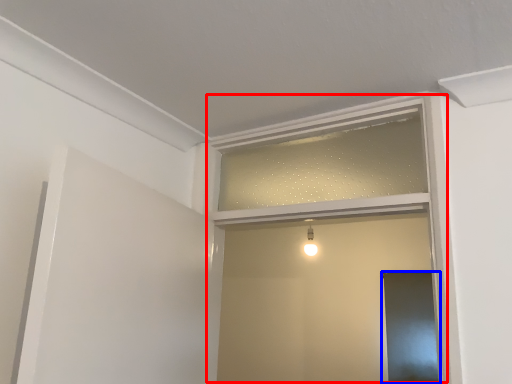
Question: Which object appears farthest to the camera in this image, window frame (highlighted by a red box) or screen door (highlighted by a blue box)?

Choices:
 (A) window frame
 (B) screen door

Answer: (B)